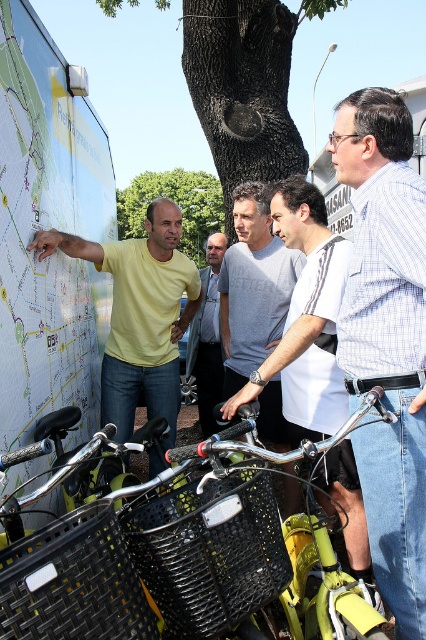
Question: Which object appears closest to the camera in this image?

Choices:
 (A) yellow matte shirt at left
 (B) gray cotton t-shirt at center
 (C) white paper map at left
 (D) green rough bark tree at center

Answer: (C)

Question: Considering the relative positions of white paper map at left and checkered shirt at center in the image provided, where is white paper map at left located with respect to checkered shirt at center?

Choices:
 (A) left
 (B) right

Answer: (A)

Question: Which of the following is the farthest from the observer?

Choices:
 (A) gray cotton t-shirt at center
 (B) white cotton shirt at center

Answer: (A)

Question: Can you confirm if black plastic basket at center is bigger than matte yellow shirt at center?

Choices:
 (A) yes
 (B) no

Answer: (B)

Question: Which object appears closest to the camera in this image?

Choices:
 (A) gray cotton t-shirt at center
 (B) matte yellow shirt at center
 (C) green leafy tree at center

Answer: (A)

Question: Is green rough bark tree at center positioned in front of green leafy tree at center?

Choices:
 (A) no
 (B) yes

Answer: (B)